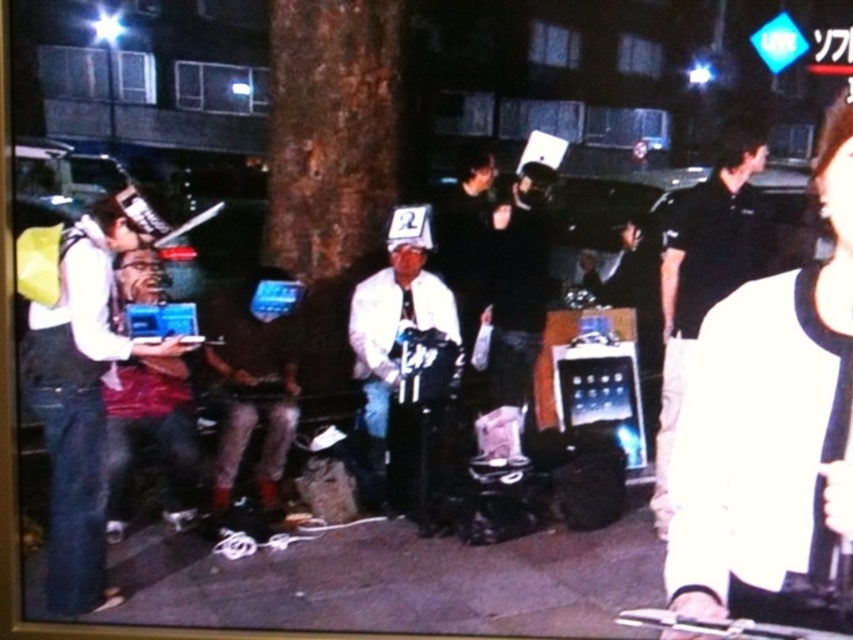
Question: Which object appears closest to the camera in this image?

Choices:
 (A) metallic silver laptop at center
 (B) black smooth shirt at right

Answer: (A)

Question: Does matte black laptop at left have a greater width compared to black smooth shirt at right?

Choices:
 (A) no
 (B) yes

Answer: (A)

Question: Can you confirm if black matte shirt at upper right is positioned below black smooth shirt at right?

Choices:
 (A) no
 (B) yes

Answer: (B)

Question: Which point appears closest to the camera in this image?

Choices:
 (A) (398, 241)
 (B) (94, 216)
 (C) (677, 248)
 (D) (274, 349)

Answer: (B)

Question: Is matte black laptop at left behind black smooth shirt at right?

Choices:
 (A) yes
 (B) no

Answer: (B)

Question: Based on their relative distances, which object is nearer to the metallic silver laptop at center?

Choices:
 (A) black matte shirt at upper right
 (B) black smooth shirt at right
 (C) white matte laptop at center

Answer: (C)